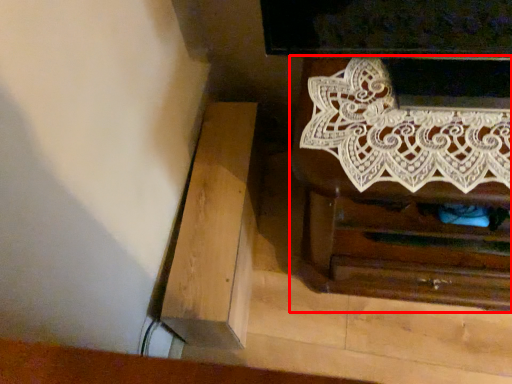
Question: From the image's perspective, what is the correct spatial relationship of chest of drawers (annotated by the red box) in relation to furniture?

Choices:
 (A) below
 (B) above

Answer: (B)